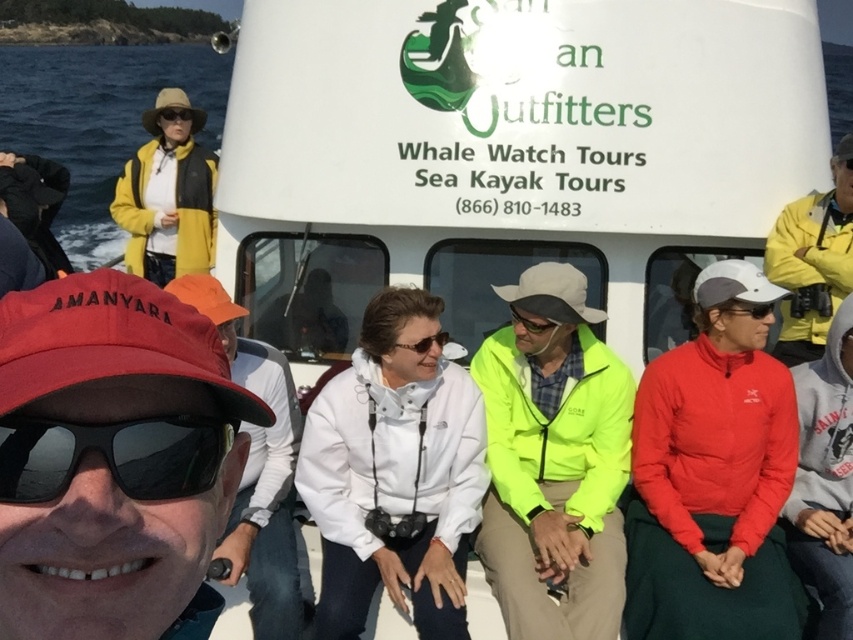
In the scene shown: You are a photographer on the boat trying to capture a closeup of the matte yellow goggles at upper left. However, the matte black sunglasses at center is blocking your view. Can you move the sunglasses to get a clear shot of the goggles?

The matte black sunglasses at center is closer to the viewer than the matte yellow goggles at upper left, so moving the sunglasses would allow you to see the goggles clearly.